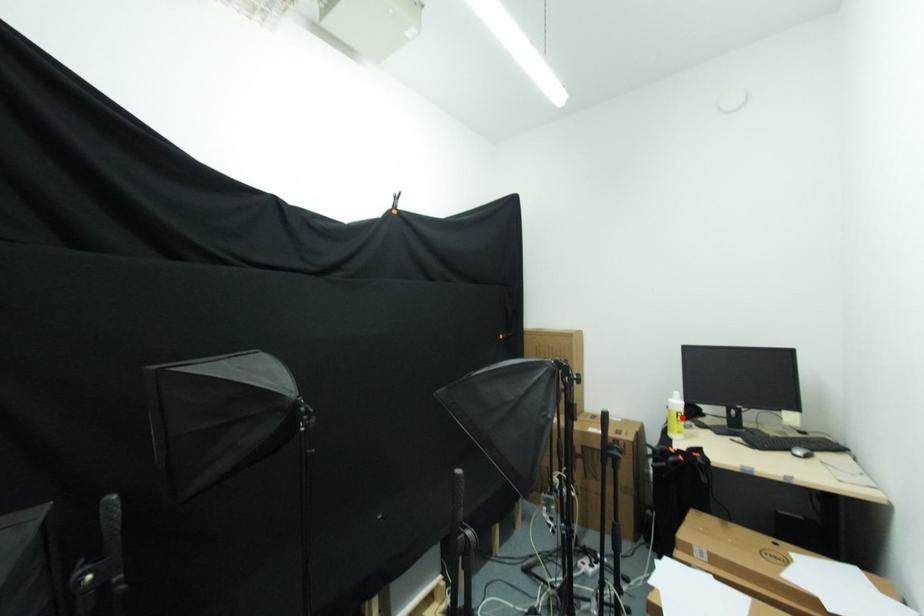
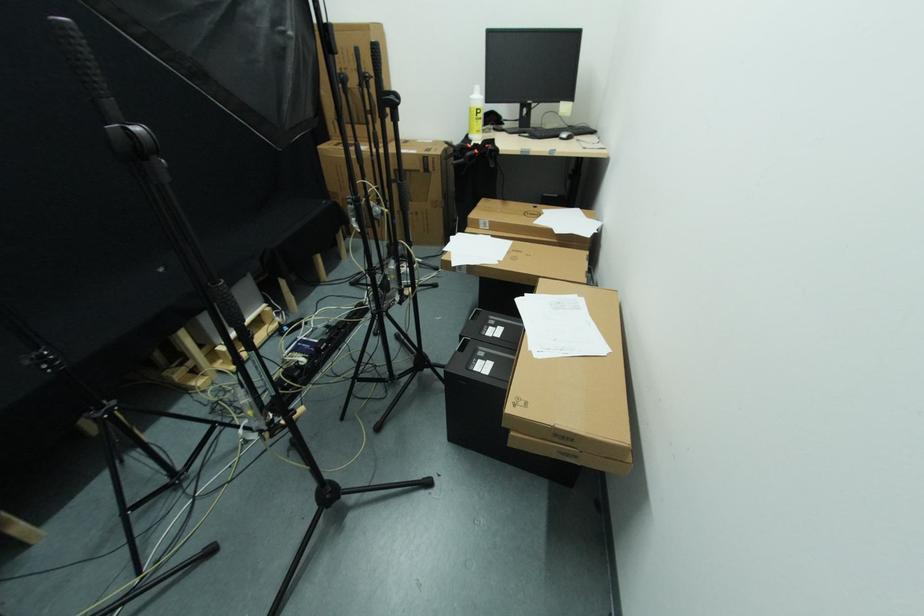
Locate, in the second image, the point that corresponds to the highlighted location in the first image.

(481, 114)